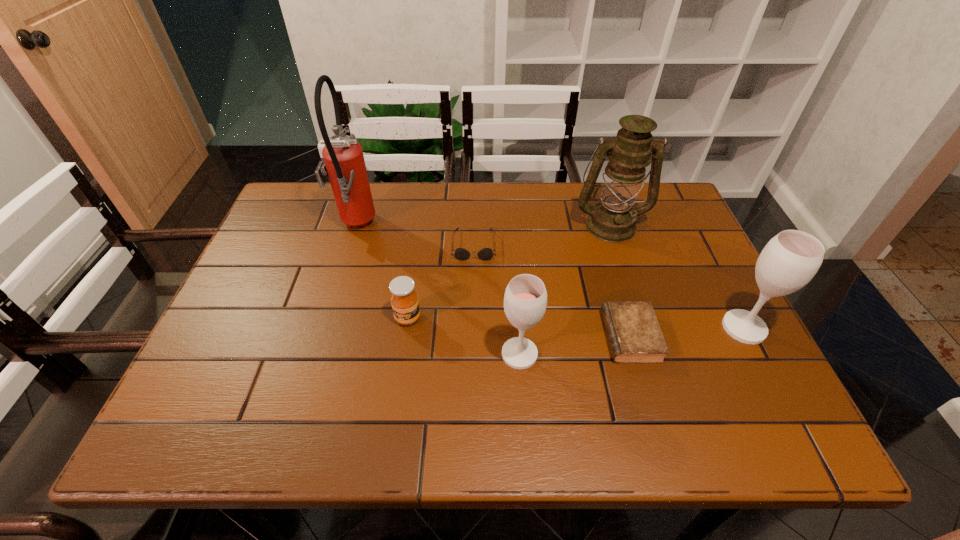
You are a GUI agent. You are given a task and a screenshot of the screen. Output one action in this format:
    pyautogui.click(x=<x>, y=<y>)
    Task: Click on the vacant space that is in between the fire extinguisher and the third tallest object
    
    Given the screenshot: What is the action you would take?
    (549, 277)

Where is `empty location between the diary and the left wineglass`? empty location between the diary and the left wineglass is located at coordinates (575, 345).

Identify which object is the sixth nearest to the sunglasses. Please provide its 2D coordinates. Your answer should be formatted as a tuple, i.e. [(x, y)], where the tuple contains the x and y coordinates of a point satisfying the conditions above.

[(788, 262)]

Image resolution: width=960 pixels, height=540 pixels. In order to click on object that is the fourth closest one to the second object from left to right in this screenshot , I will do `click(634, 335)`.

This screenshot has width=960, height=540. In order to click on vacant region that satisfies the following two spatial constraints: 1. on the front-facing side of the fifth tallest object; 2. on the left side of the fifth shortest object in this screenshot , I will do `click(406, 328)`.

The image size is (960, 540). I want to click on vacant space that satisfies the following two spatial constraints: 1. at the nozzle of the rightmost object; 2. on the right side of the leftmost object, so click(x=324, y=328).

Find the location of a particular element. The image size is (960, 540). free location that satisfies the following two spatial constraints: 1. on the back side of the fourth object from right to left; 2. on the right side of the oil lamp is located at coordinates (510, 225).

You are a GUI agent. You are given a task and a screenshot of the screen. Output one action in this format:
    pyautogui.click(x=<x>, y=<y>)
    Task: Click on the free location that satisfies the following two spatial constraints: 1. on the front-facing side of the right wineglass; 2. on the left side of the second object from left to right
    
    Given the screenshot: What is the action you would take?
    pyautogui.click(x=406, y=328)

Locate an element on the screen. free location that satisfies the following two spatial constraints: 1. on the front-facing side of the shorter wineglass; 2. on the left side of the fifth tallest object is located at coordinates (402, 354).